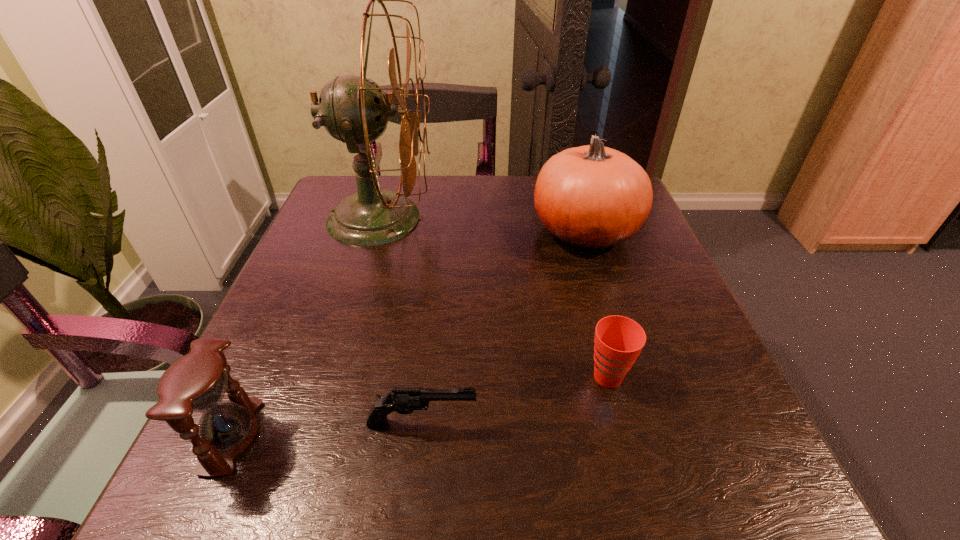
Image resolution: width=960 pixels, height=540 pixels. In order to click on fan in this screenshot , I will do `click(353, 109)`.

The height and width of the screenshot is (540, 960). In order to click on the fourth shortest object in this screenshot , I will do `click(591, 197)`.

What are the coordinates of `hourglass` in the screenshot? It's located at (196, 383).

Where is `cup`? This screenshot has height=540, width=960. cup is located at coordinates (619, 340).

Image resolution: width=960 pixels, height=540 pixels. In order to click on the third farthest object in this screenshot , I will do tap(619, 340).

Locate an element on the screen. the shortest object is located at coordinates (404, 400).

The image size is (960, 540). I want to click on vacant space located in front of the fan, directing air flow, so click(x=516, y=218).

Where is `vacant area located 0.150m on the left of the pumpkin`? The image size is (960, 540). vacant area located 0.150m on the left of the pumpkin is located at coordinates [466, 233].

Identify the location of vacant space located 0.130m on the right of the third tallest object. The width and height of the screenshot is (960, 540). (348, 436).

The width and height of the screenshot is (960, 540). What are the coordinates of `vacant area located on the back of the second shortest object` in the screenshot? It's located at (572, 241).